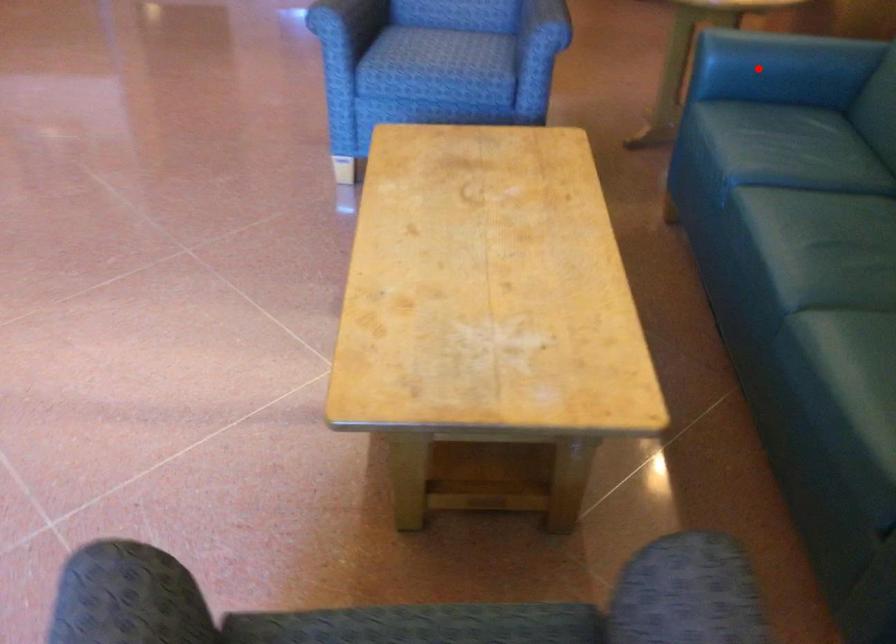
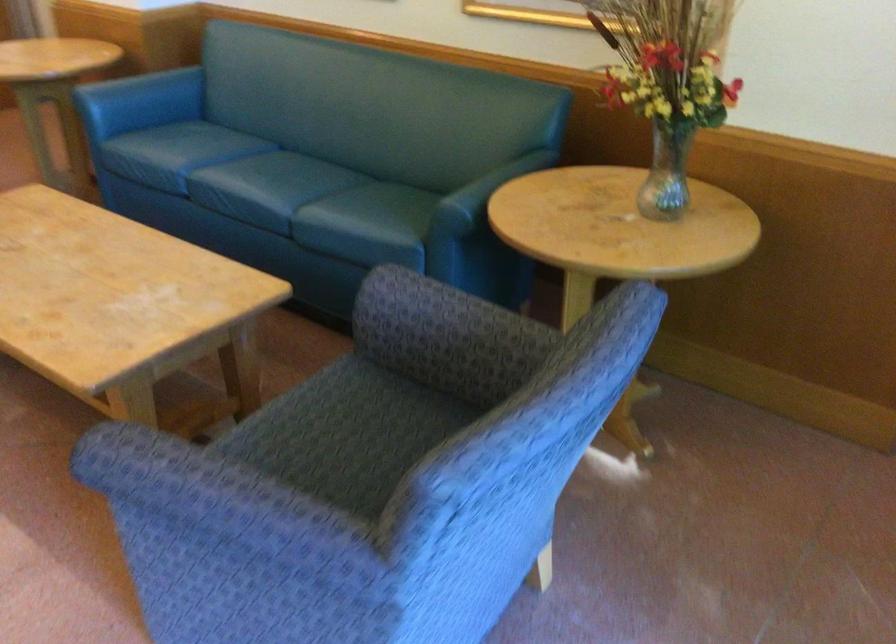
Locate, in the second image, the point that corresponds to the highlighted location in the first image.

(140, 102)